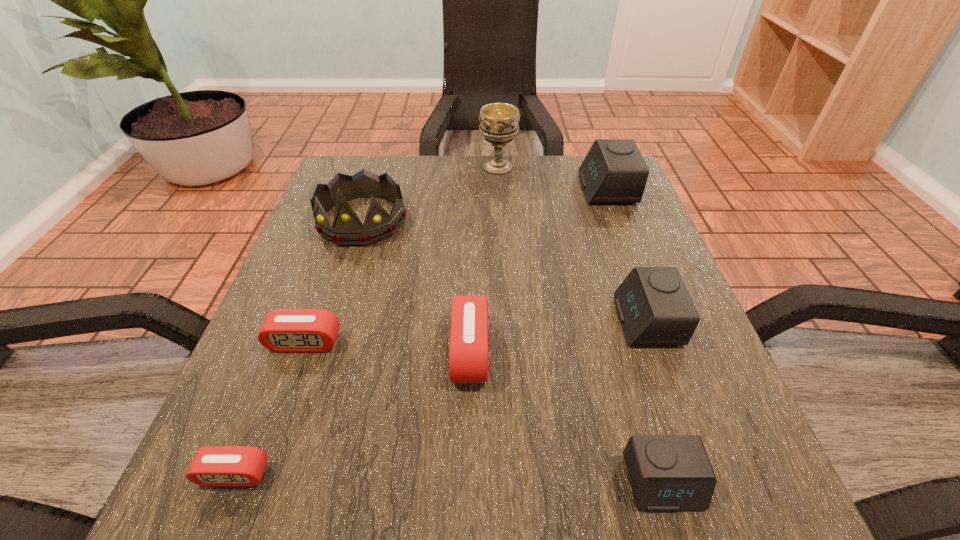
The image size is (960, 540). Find the location of `free spot between the biggest black alarm clock and the biggest pink alarm clock`. free spot between the biggest black alarm clock and the biggest pink alarm clock is located at coordinates tap(539, 270).

You are a GUI agent. You are given a task and a screenshot of the screen. Output one action in this format:
    pyautogui.click(x=<x>, y=<y>)
    Task: Click on the vacant region between the second biggest pink alarm clock and the nearest black alarm clock
    This screenshot has height=540, width=960.
    Given the screenshot: What is the action you would take?
    pyautogui.click(x=484, y=413)

In order to click on vacant point located between the second biggest pink alarm clock and the smallest black alarm clock in this screenshot , I will do `click(484, 413)`.

Where is `object that stands as the sixth closest to the biggest pink alarm clock`? This screenshot has width=960, height=540. object that stands as the sixth closest to the biggest pink alarm clock is located at coordinates (614, 171).

Where is `object that stands as the fourth closest to the nearest black alarm clock`? The width and height of the screenshot is (960, 540). object that stands as the fourth closest to the nearest black alarm clock is located at coordinates (211, 466).

Identify which alarm clock is located as the nearest to the smallest black alarm clock. Please provide its 2D coordinates. Your answer should be formatted as a tuple, i.e. [(x, y)], where the tuple contains the x and y coordinates of a point satisfying the conditions above.

[(654, 306)]

Select which alarm clock appears as the third closest to the second farthest black alarm clock. Please provide its 2D coordinates. Your answer should be formatted as a tuple, i.e. [(x, y)], where the tuple contains the x and y coordinates of a point satisfying the conditions above.

[(614, 171)]

Where is `the second closest black alarm clock relative to the biggest pink alarm clock`? This screenshot has width=960, height=540. the second closest black alarm clock relative to the biggest pink alarm clock is located at coordinates (654, 306).

Identify the location of the closest black alarm clock to the biggest pink alarm clock. This screenshot has height=540, width=960. (668, 473).

Identify which pink alarm clock is located as the third nearest to the red tiara. Please provide its 2D coordinates. Your answer should be formatted as a tuple, i.e. [(x, y)], where the tuple contains the x and y coordinates of a point satisfying the conditions above.

[(211, 466)]